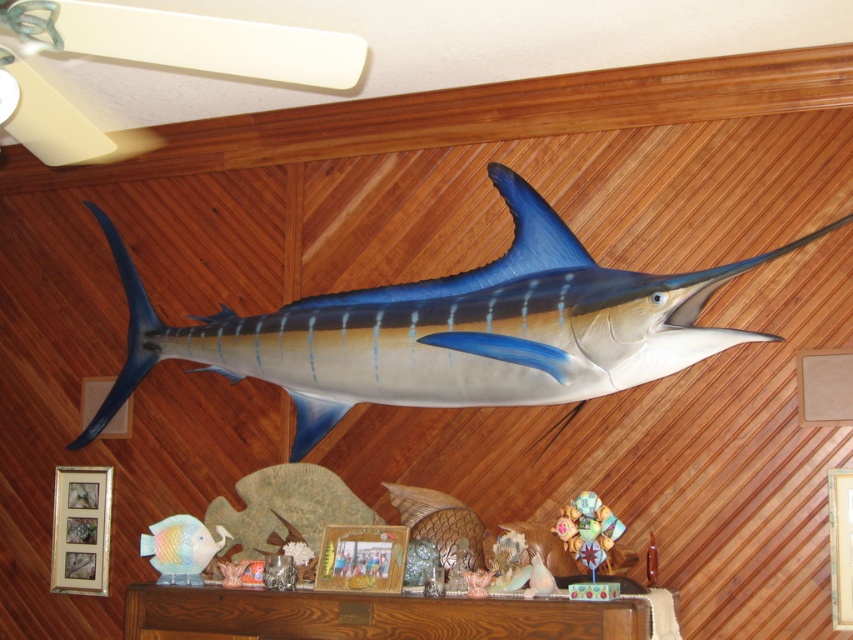
Question: Which point is farther to the camera?

Choices:
 (A) [x=173, y=518]
 (B) [x=531, y=400]

Answer: (A)

Question: Is shiny blue fish at center further to camera compared to pastel ceramic fish at lower left?

Choices:
 (A) yes
 (B) no

Answer: (B)

Question: In this image, where is shiny blue fish at center located relative to pastel ceramic fish at lower left?

Choices:
 (A) right
 (B) left

Answer: (A)

Question: Which point is closer to the camera?

Choices:
 (A) shiny blue fish at center
 (B) pastel ceramic fish at lower left

Answer: (A)

Question: Does shiny blue fish at center come behind pastel ceramic fish at lower left?

Choices:
 (A) no
 (B) yes

Answer: (A)